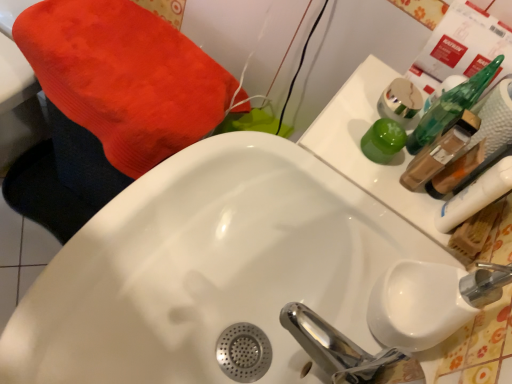
Question: Considering the relative sizes of translucent plastic mouthwash at upper right, which is the 3th mouthwash in top-to-bottom order, and metallic gold mouthwash at upper right, marked as the first mouthwash in a top-to-bottom arrangement, in the image provided, is translucent plastic mouthwash at upper right, which is the 3th mouthwash in top-to-bottom order, taller than metallic gold mouthwash at upper right, marked as the first mouthwash in a top-to-bottom arrangement,?

Choices:
 (A) no
 (B) yes

Answer: (B)

Question: Does translucent plastic mouthwash at upper right, which is the 3th mouthwash in top-to-bottom order, have a larger size compared to metallic gold mouthwash at upper right, marked as the first mouthwash in a top-to-bottom arrangement?

Choices:
 (A) yes
 (B) no

Answer: (A)

Question: Would you consider translucent plastic mouthwash at upper right, which is the 3th mouthwash in top-to-bottom order, to be distant from metallic gold mouthwash at upper right, which is counted as the 4th mouthwash, starting from the bottom?

Choices:
 (A) yes
 (B) no

Answer: (B)

Question: Is translucent plastic mouthwash at upper right, the 2th mouthwash ordered from the bottom, to the right of metallic gold mouthwash at upper right, marked as the first mouthwash in a top-to-bottom arrangement, from the viewer's perspective?

Choices:
 (A) yes
 (B) no

Answer: (A)

Question: Does translucent plastic mouthwash at upper right, which is the 3th mouthwash in top-to-bottom order, come behind metallic gold mouthwash at upper right, marked as the first mouthwash in a top-to-bottom arrangement?

Choices:
 (A) no
 (B) yes

Answer: (A)

Question: From a real-world perspective, is translucent plastic mouthwash at upper right, which is the 3th mouthwash in top-to-bottom order, physically above metallic gold mouthwash at upper right, marked as the first mouthwash in a top-to-bottom arrangement?

Choices:
 (A) no
 (B) yes

Answer: (B)

Question: Can you confirm if translucent plastic mouthwash at upper right, the 2th mouthwash ordered from the bottom, is taller than white glossy sink at center?

Choices:
 (A) yes
 (B) no

Answer: (B)

Question: From the image's perspective, is translucent plastic mouthwash at upper right, the 2th mouthwash ordered from the bottom, over white glossy sink at center?

Choices:
 (A) yes
 (B) no

Answer: (A)

Question: Is translucent plastic mouthwash at upper right, which is the 3th mouthwash in top-to-bottom order, directly adjacent to white glossy sink at center?

Choices:
 (A) yes
 (B) no

Answer: (B)

Question: Is translucent plastic mouthwash at upper right, which is the 3th mouthwash in top-to-bottom order, wider than white glossy sink at center?

Choices:
 (A) yes
 (B) no

Answer: (B)

Question: Can you confirm if translucent plastic mouthwash at upper right, the 2th mouthwash ordered from the bottom, is shorter than white glossy sink at center?

Choices:
 (A) yes
 (B) no

Answer: (A)

Question: Is translucent plastic mouthwash at upper right, the 2th mouthwash ordered from the bottom, not inside white glossy sink at center?

Choices:
 (A) yes
 (B) no

Answer: (A)

Question: From a real-world perspective, is white glossy sink at center positioned under translucent plastic mouthwash at upper right, which is the 3th mouthwash in top-to-bottom order, based on gravity?

Choices:
 (A) yes
 (B) no

Answer: (A)